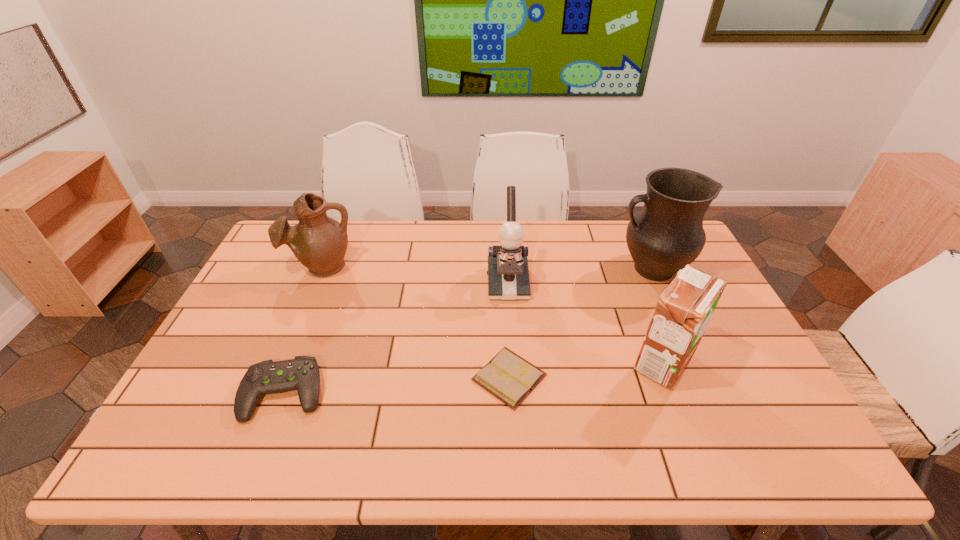
The width and height of the screenshot is (960, 540). I want to click on object positioned at the far left corner, so click(x=319, y=242).

Find the location of a particular element. The height and width of the screenshot is (540, 960). object located in the far right corner section of the desktop is located at coordinates (667, 234).

The height and width of the screenshot is (540, 960). In the image, there is a desktop. Identify the location of vacant space at the far edge. (540, 247).

At what (x,y) coordinates should I click in order to perform the action: click on vacant area at the near edge of the desktop. Please return your answer as a coordinate pair (x, y). The height and width of the screenshot is (540, 960). Looking at the image, I should click on (528, 433).

The height and width of the screenshot is (540, 960). I want to click on free region at the left edge, so click(216, 399).

Image resolution: width=960 pixels, height=540 pixels. In the image, there is a desktop. Identify the location of vacant space at the right edge. (709, 379).

Where is `vacant area between the diary and the shorter pitcher`? vacant area between the diary and the shorter pitcher is located at coordinates (416, 322).

Identify the location of free space between the shortest object and the carton. Image resolution: width=960 pixels, height=540 pixels. (587, 370).

The image size is (960, 540). Identify the location of blank region between the microscope and the shorter pitcher. (415, 275).

Find the location of a particular element. This screenshot has width=960, height=540. free space between the right pitcher and the diary is located at coordinates (580, 323).